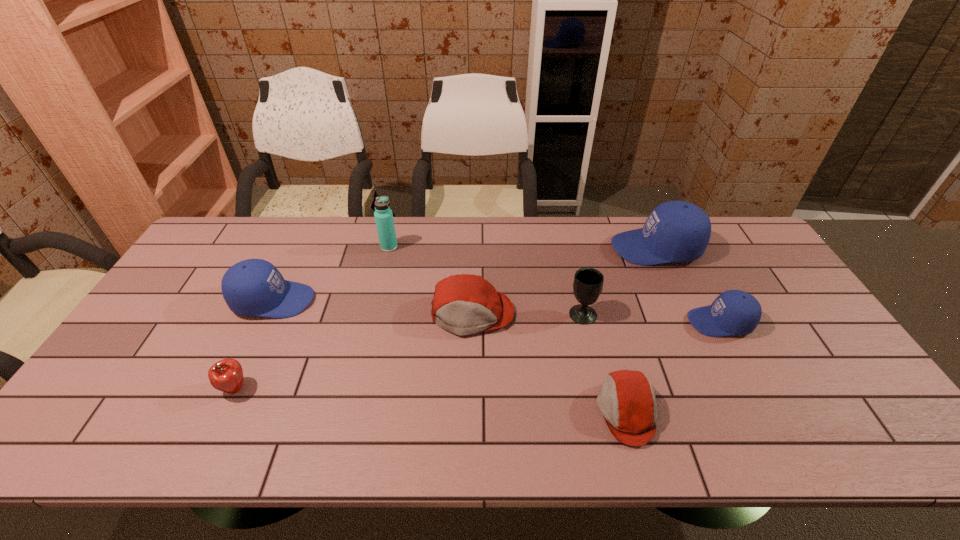
Find the location of a particular element. free space that is in between the smallest blue cap and the chalice is located at coordinates (651, 318).

The width and height of the screenshot is (960, 540). Identify the location of empty space that is in between the smaller red cap and the second cap from left to right. (549, 363).

Locate an element on the screen. The width and height of the screenshot is (960, 540). free space between the tallest cap and the thermos bottle is located at coordinates (522, 247).

This screenshot has width=960, height=540. Find the location of `vacant area that lies between the left red cap and the shortest cap`. vacant area that lies between the left red cap and the shortest cap is located at coordinates (549, 363).

Locate an element on the screen. vacant area that lies between the nearer red cap and the apple is located at coordinates (431, 400).

Choose which object is the second nearest neighbor to the farther red cap. Please provide its 2D coordinates. Your answer should be formatted as a tuple, i.e. [(x, y)], where the tuple contains the x and y coordinates of a point satisfying the conditions above.

[(627, 402)]

Identify the location of object that is the third closest to the left red cap. The image size is (960, 540). (383, 214).

Identify which cap is the fourth closest to the biggest blue cap. Please provide its 2D coordinates. Your answer should be formatted as a tuple, i.e. [(x, y)], where the tuple contains the x and y coordinates of a point satisfying the conditions above.

[(254, 287)]

At what (x,y) coordinates should I click in order to perform the action: click on cap that is the second closest to the smallest blue cap. Please return your answer as a coordinate pair (x, y). Image resolution: width=960 pixels, height=540 pixels. Looking at the image, I should click on (627, 402).

Where is `blue cap that can be found as the second closest to the farthest blue cap`? blue cap that can be found as the second closest to the farthest blue cap is located at coordinates (254, 287).